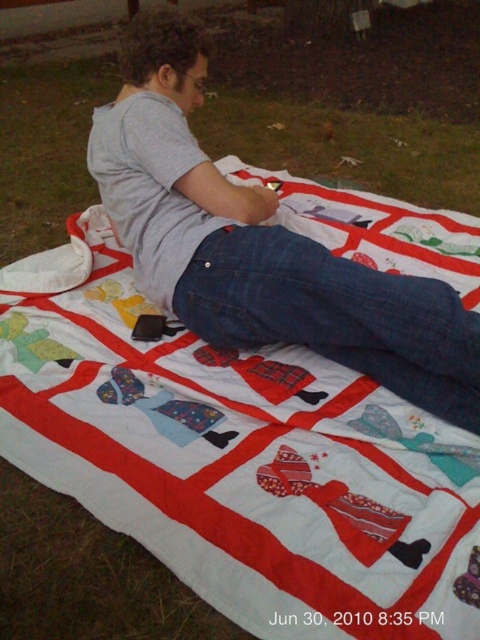
Can you confirm if gray cotton shirt at upper center is positioned below denim at center?

No, gray cotton shirt at upper center is not below denim at center.

This screenshot has height=640, width=480. I want to click on gray cotton shirt at upper center, so click(x=259, y=244).

The height and width of the screenshot is (640, 480). I want to click on gray cotton shirt at upper center, so click(259, 244).